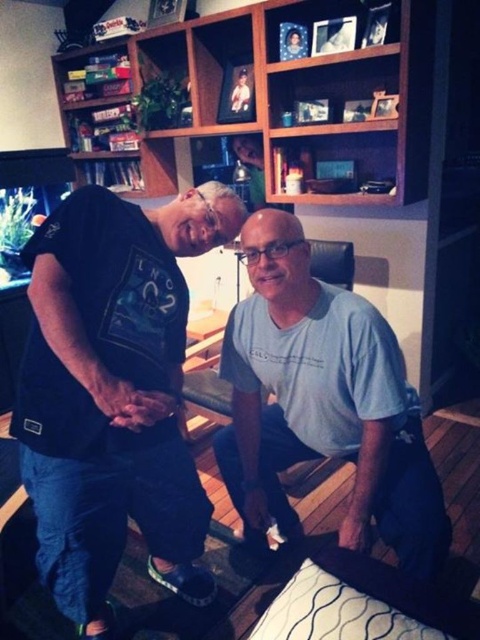
Describe the element at coordinates (112, 394) in the screenshot. This screenshot has width=480, height=640. I see `black cotton t-shirt at center` at that location.

Find the location of a particular element. Image resolution: width=480 pixels, height=640 pixels. black cotton t-shirt at center is located at coordinates (112, 394).

Who is more forward, (115, 516) or (326, 410)?

Positioned in front is point (115, 516).

I want to click on black cotton t-shirt at center, so click(x=112, y=394).

Which is above, light blue cotton shirt at center or wooden bookshelf at upper center?

Positioned higher is wooden bookshelf at upper center.

Who is more distant from viewer, (381,424) or (372,88)?

The point (372,88) is behind.

Locate an element on the screen. Image resolution: width=480 pixels, height=640 pixels. light blue cotton shirt at center is located at coordinates click(323, 404).

Does point (91, 561) come farther from viewer compared to point (82, 100)?

No, it is not.

Measure the distance between point (108, 408) and camera.

A distance of 4.50 feet exists between point (108, 408) and camera.

You are a GUI agent. You are given a task and a screenshot of the screen. Output one action in this format:
    pyautogui.click(x=<x>, y=<y>)
    Task: Click on the black cotton t-shirt at center
    
    Given the screenshot: What is the action you would take?
    pyautogui.click(x=112, y=394)